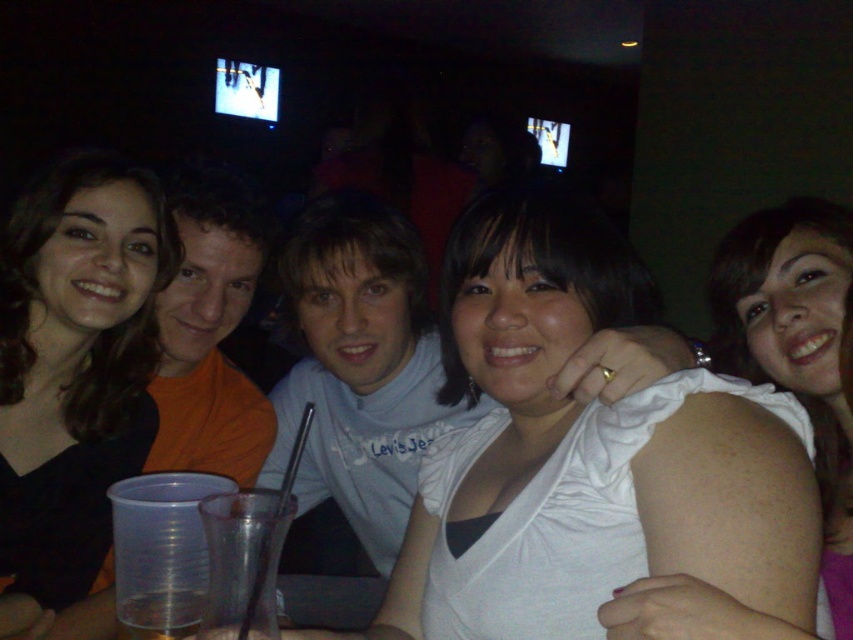
Question: Can you confirm if white cotton shirt at center is wider than white matte shoulder at upper right?

Choices:
 (A) yes
 (B) no

Answer: (A)

Question: Which object is the closest to the white matte shoulder at upper right?

Choices:
 (A) white matte shirt at center
 (B) white cotton shirt at center

Answer: (A)

Question: Which point appears closest to the camera in this image?

Choices:
 (A) (67, 474)
 (B) (656, 419)
 (C) (122, 604)

Answer: (B)

Question: Can you confirm if white matte shirt at center is wider than smooth black hair at left?

Choices:
 (A) no
 (B) yes

Answer: (B)

Question: Can you confirm if white cotton shirt at center is positioned above clear plastic cup at lower left?

Choices:
 (A) yes
 (B) no

Answer: (A)

Question: Which point appears closest to the camera in this image?

Choices:
 (A) (566, 260)
 (B) (395, 532)

Answer: (A)